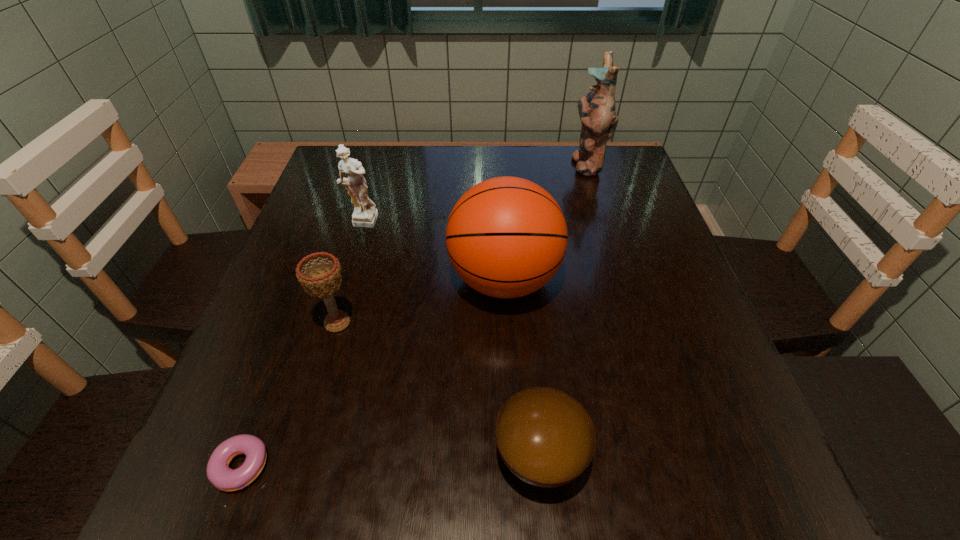
Find the location of a particular element. This screenshot has height=540, width=960. chalice at the left edge is located at coordinates (320, 274).

Locate an element on the screen. This screenshot has height=540, width=960. doughnut located in the left edge section of the desktop is located at coordinates (219, 474).

Find the location of a particular element. object present at the right edge is located at coordinates (597, 110).

This screenshot has height=540, width=960. I want to click on object that is at the near left corner, so [x=219, y=474].

Where is `object located at the far right corner`? The width and height of the screenshot is (960, 540). object located at the far right corner is located at coordinates (597, 110).

Where is `vacant space at the far edge of the desktop`? This screenshot has width=960, height=540. vacant space at the far edge of the desktop is located at coordinates (465, 166).

This screenshot has height=540, width=960. I want to click on vacant region at the near edge of the desktop, so tap(616, 477).

In the image, there is a desktop. At what (x,y) coordinates should I click in order to perform the action: click on vacant region at the right edge. Please return your answer as a coordinate pair (x, y). This screenshot has height=540, width=960. Looking at the image, I should click on (665, 270).

The height and width of the screenshot is (540, 960). I want to click on vacant space at the far right corner, so click(x=620, y=170).

Image resolution: width=960 pixels, height=540 pixels. What are the coordinates of `free spot between the doughnut and the farthest object` in the screenshot? It's located at (413, 319).